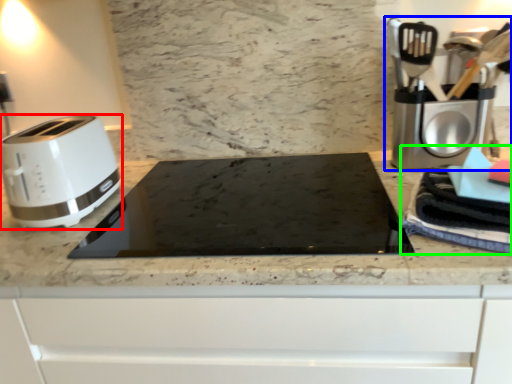
Question: Considering the real-world distances, which object is closest to toaster (highlighted by a red box)? coffee machine (highlighted by a blue box) or blanket (highlighted by a green box).

Choices:
 (A) coffee machine
 (B) blanket

Answer: (B)